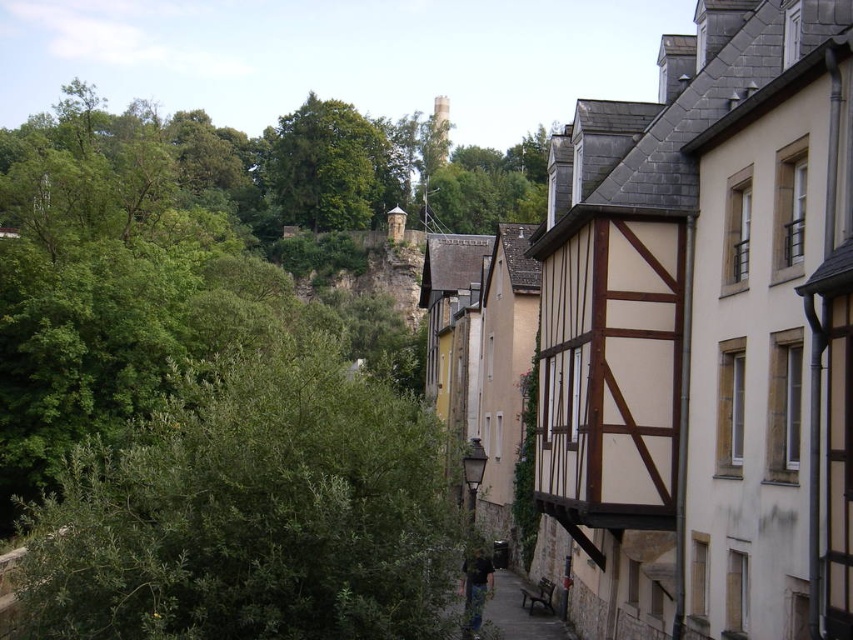
How distant is green leafy bush at left from green leafy tree at upper center?

green leafy bush at left is 183.33 meters away from green leafy tree at upper center.

Can you confirm if green leafy bush at left is thinner than green leafy tree at upper center?

Yes.

What do you see at coordinates (253, 513) in the screenshot?
I see `green leafy bush at left` at bounding box center [253, 513].

What are the coordinates of `green leafy bush at left` in the screenshot? It's located at (253, 513).